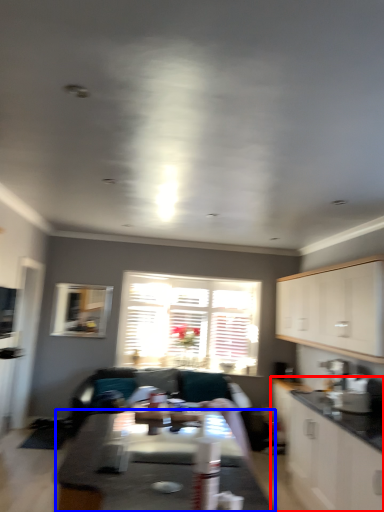
Question: Among these objects, which one is farthest to the camera, cabinetry (highlighted by a red box) or table (highlighted by a blue box)?

Choices:
 (A) cabinetry
 (B) table

Answer: (A)